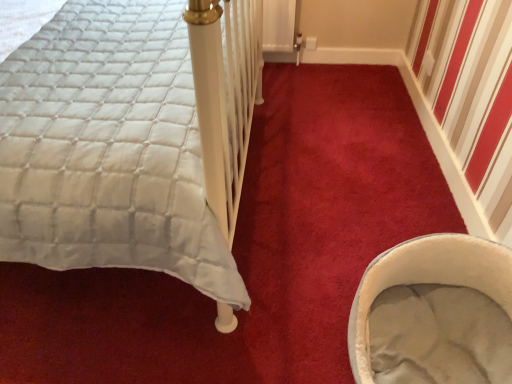
Question: Does soft gray fabric baby carriage at lower right have a smaller size compared to white quilted fabric at left?

Choices:
 (A) yes
 (B) no

Answer: (A)

Question: Can you confirm if soft gray fabric baby carriage at lower right is bigger than white quilted fabric at left?

Choices:
 (A) no
 (B) yes

Answer: (A)

Question: Is soft gray fabric baby carriage at lower right taller than white quilted fabric at left?

Choices:
 (A) no
 (B) yes

Answer: (A)

Question: Is white quilted fabric at left located within soft gray fabric baby carriage at lower right?

Choices:
 (A) yes
 (B) no

Answer: (B)

Question: Considering the relative positions of soft gray fabric baby carriage at lower right and white quilted fabric at left in the image provided, is soft gray fabric baby carriage at lower right behind white quilted fabric at left?

Choices:
 (A) no
 (B) yes

Answer: (B)

Question: Considering the relative sizes of soft gray fabric baby carriage at lower right and white quilted fabric at left in the image provided, is soft gray fabric baby carriage at lower right shorter than white quilted fabric at left?

Choices:
 (A) no
 (B) yes

Answer: (B)

Question: From a real-world perspective, does white quilted fabric at left stand above soft gray fabric baby carriage at lower right?

Choices:
 (A) no
 (B) yes

Answer: (B)

Question: Is white quilted fabric at left wider than soft gray fabric baby carriage at lower right?

Choices:
 (A) yes
 (B) no

Answer: (A)

Question: Is white quilted fabric at left turned away from soft gray fabric baby carriage at lower right?

Choices:
 (A) no
 (B) yes

Answer: (A)

Question: From a real-world perspective, is white quilted fabric at left located beneath soft gray fabric baby carriage at lower right?

Choices:
 (A) no
 (B) yes

Answer: (A)

Question: Can you confirm if white quilted fabric at left is thinner than soft gray fabric baby carriage at lower right?

Choices:
 (A) yes
 (B) no

Answer: (B)

Question: Is white quilted fabric at left to the right of soft gray fabric baby carriage at lower right from the viewer's perspective?

Choices:
 (A) no
 (B) yes

Answer: (A)

Question: In the image, is soft gray fabric baby carriage at lower right on the left side or the right side of white quilted fabric at left?

Choices:
 (A) left
 (B) right

Answer: (B)